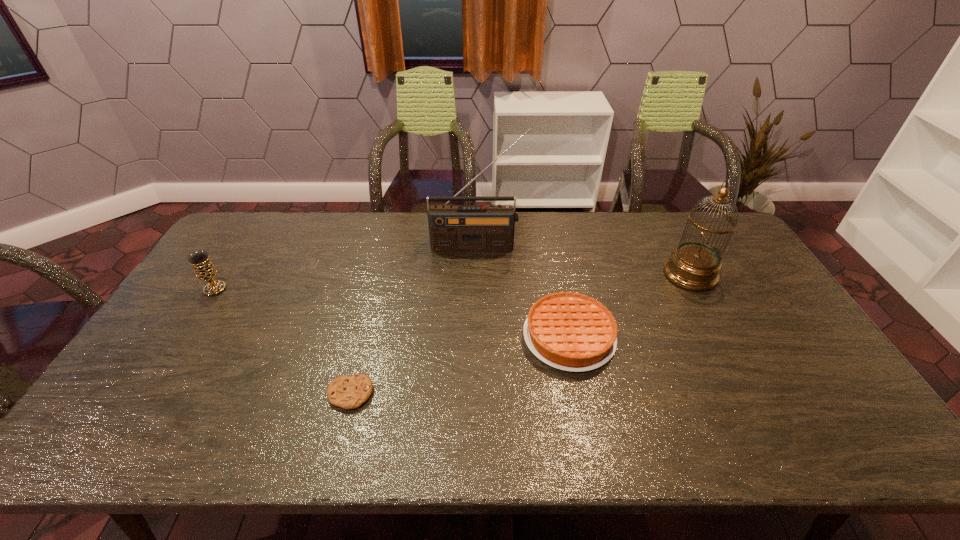
You are a GUI agent. You are given a task and a screenshot of the screen. Output one action in this format:
    pyautogui.click(x=<x>, y=<y>)
    Task: Click on the vacant space situated 0.310m on the front-facing side of the radio receiver
    This screenshot has height=540, width=960.
    Given the screenshot: What is the action you would take?
    pyautogui.click(x=476, y=321)

Identify the location of free space located 0.340m with an open door on the birdcage. The image size is (960, 540). (559, 274).

The image size is (960, 540). Find the location of `vacant space situated 0.350m with an open door on the birdcage`. vacant space situated 0.350m with an open door on the birdcage is located at coordinates (556, 274).

Identify the location of free location located 0.280m with an open door on the birdcage. (578, 274).

I want to click on free space located 0.210m on the front of the third tallest object, so click(x=175, y=351).

The height and width of the screenshot is (540, 960). Find the location of `free space located 0.060m on the front of the fourth tallest object`. free space located 0.060m on the front of the fourth tallest object is located at coordinates (581, 395).

The height and width of the screenshot is (540, 960). What are the coordinates of `vacant region located 0.110m on the left of the nearest object` in the screenshot? It's located at (283, 394).

Image resolution: width=960 pixels, height=540 pixels. What are the coordinates of `object located at the far edge` in the screenshot? It's located at (490, 228).

The height and width of the screenshot is (540, 960). Find the location of `object present at the left edge`. object present at the left edge is located at coordinates (205, 271).

Where is `object located at the right edge`? object located at the right edge is located at coordinates pyautogui.click(x=693, y=265).